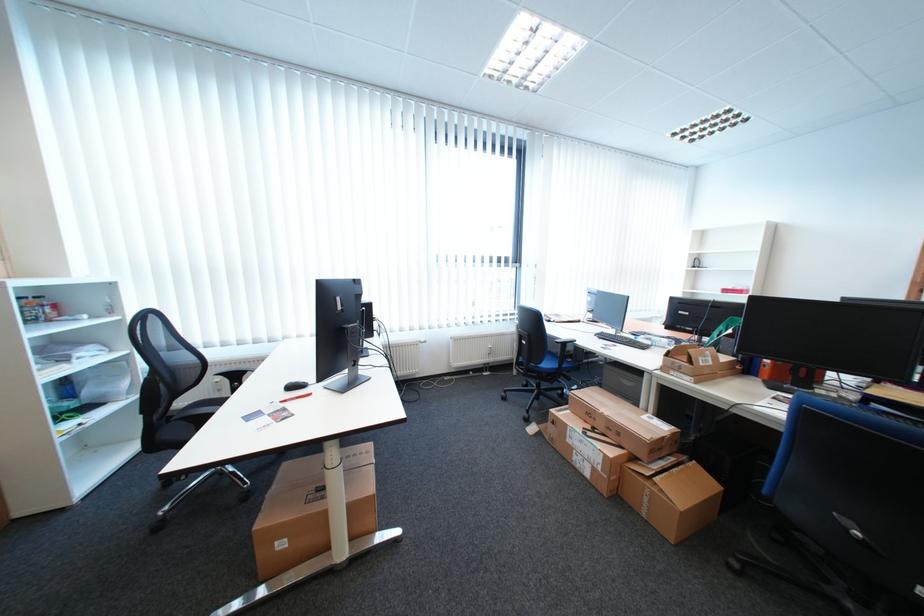
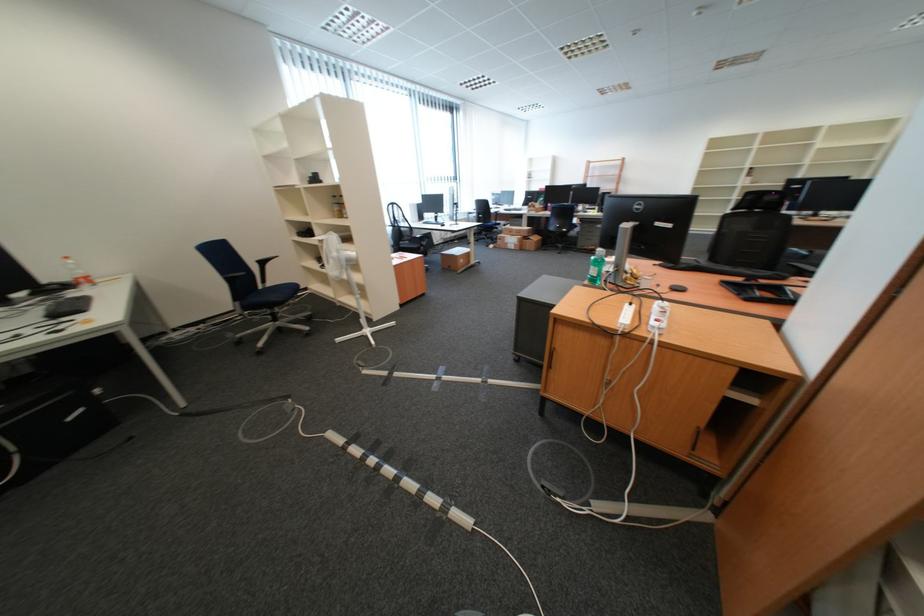
The point at (630, 436) is marked in the first image. Where is the corresponding point in the second image?

(531, 233)